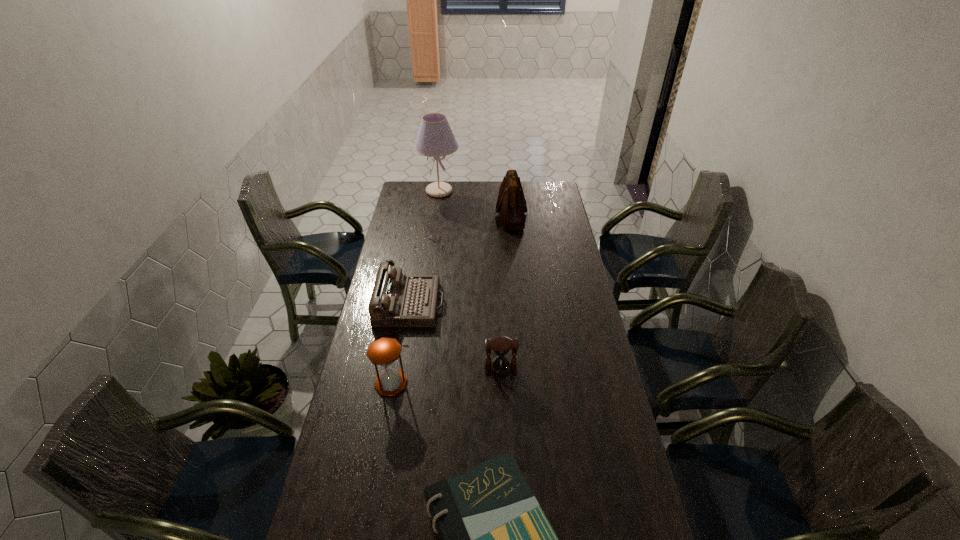
Identify the location of vacant space that's between the right hourglass and the lampshade. (469, 280).

Identify the location of free space that is in between the tallest object and the right hourglass. (469, 280).

Locate an element on the screen. The width and height of the screenshot is (960, 540). unoccupied position between the shorter hourglass and the third farthest object is located at coordinates (455, 336).

The width and height of the screenshot is (960, 540). Find the location of `vacant space in between the second tallest object and the lampshade`. vacant space in between the second tallest object and the lampshade is located at coordinates (475, 202).

Where is `blank region between the tallest object and the fourth nearest object`? This screenshot has height=540, width=960. blank region between the tallest object and the fourth nearest object is located at coordinates (424, 248).

Where is `empty space that is in between the third farthest object and the right hourglass`? This screenshot has height=540, width=960. empty space that is in between the third farthest object and the right hourglass is located at coordinates (455, 336).

The image size is (960, 540). I want to click on free space that is in between the lampshade and the second tallest object, so (475, 202).

Where is `object that ranks as the fourth closest to the third tallest object`? The width and height of the screenshot is (960, 540). object that ranks as the fourth closest to the third tallest object is located at coordinates (511, 204).

Identify which object is the second closest to the right hourglass. Please provide its 2D coordinates. Your answer should be formatted as a tuple, i.e. [(x, y)], where the tuple contains the x and y coordinates of a point satisfying the conditions above.

[(384, 351)]

At what (x,y) coordinates should I click in order to perform the action: click on free space that satisfies the following two spatial constraints: 1. on the front side of the tallest object; 2. on the keyboard of the typewriter. Please return your answer as a coordinate pair (x, y). The width and height of the screenshot is (960, 540). Looking at the image, I should click on (423, 304).